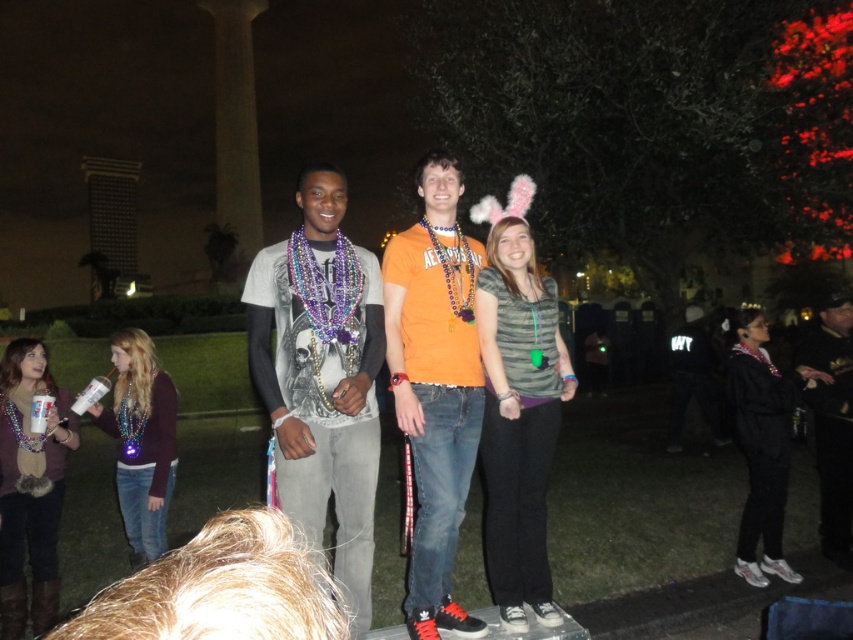
Who is higher up, orange t-shirt at center or dark blue uniform at right?

orange t-shirt at center is higher up.

Who is taller, orange t-shirt at center or dark blue uniform at right?

With more height is orange t-shirt at center.

Who is more distant from viewer, [451,472] or [837,378]?

Point [837,378]

This screenshot has height=640, width=853. I want to click on orange t-shirt at center, so click(x=434, y=385).

Which is behind, point (347, 275) or point (840, 371)?

The point (840, 371) is more distant.

Is matte gray t-shirt at center shorter than dark blue uniform at right?

No.

Find the location of `matte gray t-shirt at center`. matte gray t-shirt at center is located at coordinates (322, 376).

You are a GUI agent. You are given a task and a screenshot of the screen. Output one action in this format:
    pyautogui.click(x=<x>, y=<y>)
    Task: Click on the matte gray t-shirt at center
    
    Given the screenshot: What is the action you would take?
    pyautogui.click(x=322, y=376)

Can you confirm if matte gray t-shirt at center is positioned to the left of orange t-shirt at center?

Correct, you'll find matte gray t-shirt at center to the left of orange t-shirt at center.

Between point (335, 278) and point (442, 358), which one is positioned in front?

Point (335, 278) is in front.

This screenshot has width=853, height=640. Describe the element at coordinates (322, 376) in the screenshot. I see `matte gray t-shirt at center` at that location.

Identify the location of matte gray t-shirt at center. 322,376.